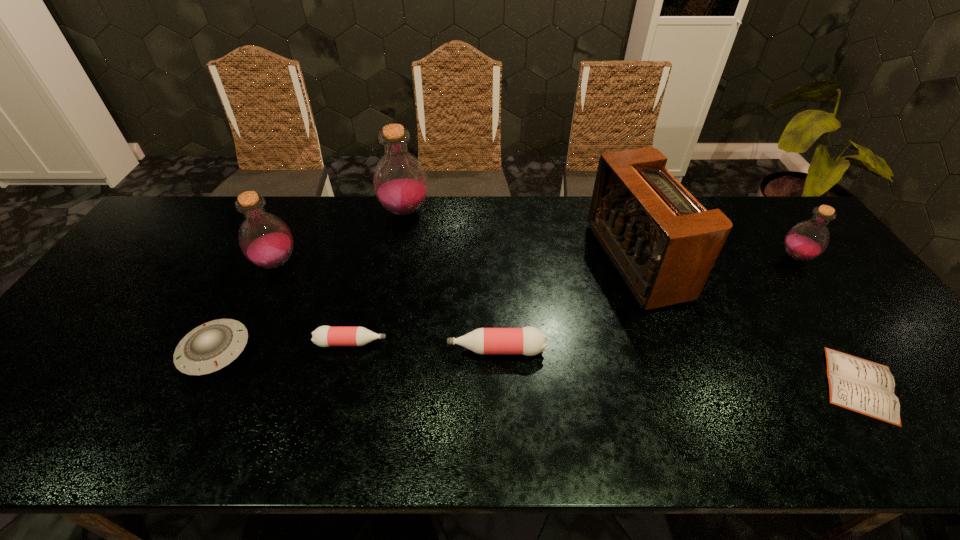
Find the location of a particular element. This screenshot has width=960, height=540. purple bottle that is the closest to the diary is located at coordinates (808, 239).

At what (x,y) coordinates should I click in order to perform the action: click on free spot that satisfies the following two spatial constraints: 1. on the front side of the tallest bottle; 2. on the left side of the third object from right to left. Please return your answer as a coordinate pair (x, y). This screenshot has height=540, width=960. Looking at the image, I should click on (396, 261).

Find the location of `free location that satisfies the following two spatial constraints: 1. with the cap open on the shortest bottle; 2. on the back side of the white diary`. free location that satisfies the following two spatial constraints: 1. with the cap open on the shortest bottle; 2. on the back side of the white diary is located at coordinates (341, 384).

The height and width of the screenshot is (540, 960). I want to click on free space that satisfies the following two spatial constraints: 1. with the cap open on the fourth tallest bottle; 2. on the left side of the shortest object, so click(497, 384).

The height and width of the screenshot is (540, 960). In order to click on vacant area that satisfies the following two spatial constraints: 1. on the front side of the farthest purple bottle; 2. with the cap open on the left pink bottle in this screenshot , I will do `click(379, 343)`.